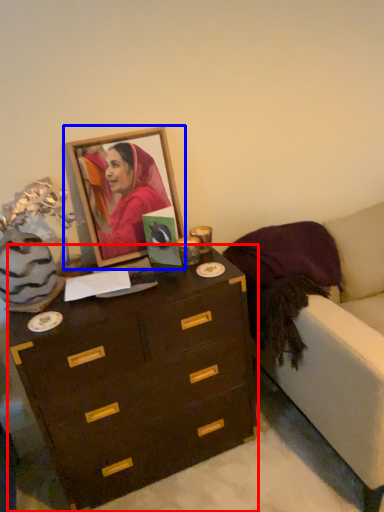
Question: Which object is further to the camera taking this photo, chest of drawers (highlighted by a red box) or picture frame (highlighted by a blue box)?

Choices:
 (A) chest of drawers
 (B) picture frame

Answer: (B)